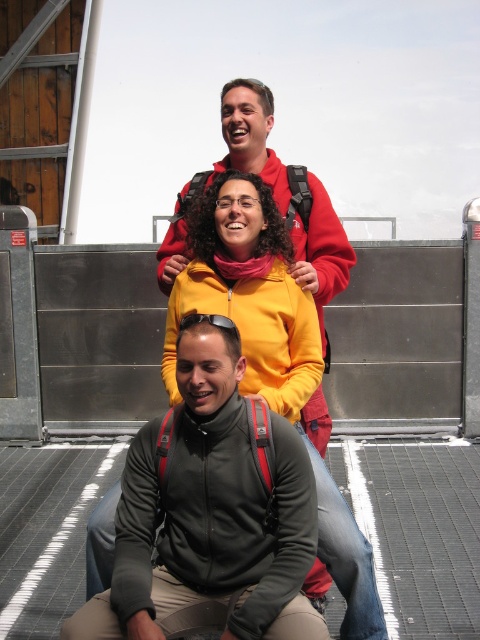
Based on the scene description, where is the yellow matte jacket at center located in terms of coordinates?

The yellow matte jacket at center is located at coordinates point (271, 355).

Looking at this image, you are a photographer trying to capture a candid shot of the yellow matte jacket at center and the matte red jacket at upper center. Based on their positions, can you tell which jacket is closer to the camera?

The yellow matte jacket at center is positioned under the matte red jacket at upper center, so the matte red jacket at upper center is closer to the camera.

Looking at this image, you are trying to locate the yellow matte jacket at center and the matte red jacket at upper center in the image. Based on their positions, which jacket is closer to the left side of the image?

The yellow matte jacket at center is to the left of matte red jacket at upper center, so the yellow matte jacket at center is closer to the left side of the image.